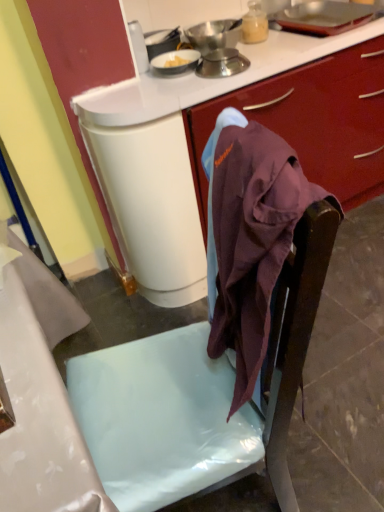
Question: Is metallic silver scale at upper center, placed as the 2th kitchen appliance when sorted from top to bottom, in contact with metallic silver bowl at upper center, the second kitchen appliance positioned from the bottom?

Choices:
 (A) no
 (B) yes

Answer: (A)

Question: Would you say metallic silver scale at upper center, the first kitchen appliance from the bottom, is outside metallic silver bowl at upper center, the second kitchen appliance positioned from the bottom?

Choices:
 (A) yes
 (B) no

Answer: (A)

Question: Considering the relative sizes of metallic silver scale at upper center, the first kitchen appliance from the bottom, and metallic silver bowl at upper center, which is counted as the first kitchen appliance, starting from the top, in the image provided, is metallic silver scale at upper center, the first kitchen appliance from the bottom, thinner than metallic silver bowl at upper center, which is counted as the first kitchen appliance, starting from the top,?

Choices:
 (A) no
 (B) yes

Answer: (B)

Question: From the image's perspective, is metallic silver scale at upper center, the first kitchen appliance from the bottom, located beneath metallic silver bowl at upper center, which is counted as the first kitchen appliance, starting from the top?

Choices:
 (A) yes
 (B) no

Answer: (A)

Question: Is metallic silver scale at upper center, placed as the 2th kitchen appliance when sorted from top to bottom, bigger than metallic silver bowl at upper center, which is counted as the first kitchen appliance, starting from the top?

Choices:
 (A) yes
 (B) no

Answer: (B)

Question: Can you confirm if metallic silver scale at upper center, the first kitchen appliance from the bottom, is positioned to the left of metallic silver bowl at upper center, the second kitchen appliance positioned from the bottom?

Choices:
 (A) no
 (B) yes

Answer: (A)

Question: Can you confirm if metallic silver bowl at upper center, which is counted as the first kitchen appliance, starting from the top, is bigger than metallic silver scale at upper center, placed as the 2th kitchen appliance when sorted from top to bottom?

Choices:
 (A) yes
 (B) no

Answer: (A)

Question: Does metallic silver bowl at upper center, which is counted as the first kitchen appliance, starting from the top, appear on the left side of metallic silver scale at upper center, placed as the 2th kitchen appliance when sorted from top to bottom?

Choices:
 (A) yes
 (B) no

Answer: (A)

Question: Could you tell me if metallic silver bowl at upper center, which is counted as the first kitchen appliance, starting from the top, is turned towards metallic silver scale at upper center, placed as the 2th kitchen appliance when sorted from top to bottom?

Choices:
 (A) no
 (B) yes

Answer: (B)

Question: Does metallic silver bowl at upper center, the second kitchen appliance positioned from the bottom, have a lesser width compared to metallic silver scale at upper center, placed as the 2th kitchen appliance when sorted from top to bottom?

Choices:
 (A) yes
 (B) no

Answer: (B)

Question: Is metallic silver bowl at upper center, which is counted as the first kitchen appliance, starting from the top, in front of metallic silver scale at upper center, placed as the 2th kitchen appliance when sorted from top to bottom?

Choices:
 (A) no
 (B) yes

Answer: (A)

Question: From the image's perspective, is metallic silver bowl at upper center, the second kitchen appliance positioned from the bottom, above metallic silver scale at upper center, placed as the 2th kitchen appliance when sorted from top to bottom?

Choices:
 (A) no
 (B) yes

Answer: (B)

Question: Can you confirm if matte plastic chair at center is positioned to the right of metallic silver bowl at upper center, the second kitchen appliance positioned from the bottom?

Choices:
 (A) no
 (B) yes

Answer: (B)